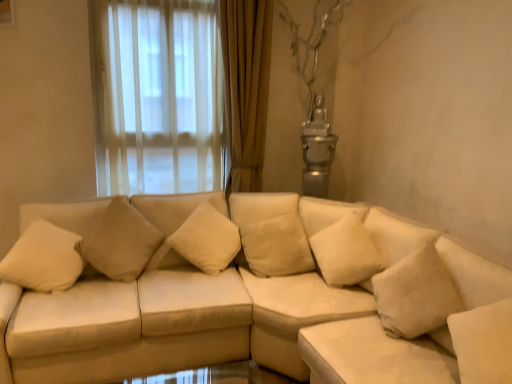
Question: Does beige leather couch at center have a lesser height compared to beige fabric pillow at center, arranged as the 1th pillow when viewed from the left?

Choices:
 (A) no
 (B) yes

Answer: (A)

Question: Considering the relative sizes of beige leather couch at center and beige fabric pillow at center, which is the second pillow from right to left, in the image provided, is beige leather couch at center taller than beige fabric pillow at center, which is the second pillow from right to left,?

Choices:
 (A) yes
 (B) no

Answer: (A)

Question: Does beige leather couch at center have a lesser width compared to beige fabric pillow at center, arranged as the 1th pillow when viewed from the left?

Choices:
 (A) yes
 (B) no

Answer: (B)

Question: Is beige leather couch at center closer to camera compared to beige fabric pillow at center, arranged as the 1th pillow when viewed from the left?

Choices:
 (A) no
 (B) yes

Answer: (B)

Question: Is beige leather couch at center not inside beige fabric pillow at center, which is the second pillow from right to left?

Choices:
 (A) no
 (B) yes

Answer: (B)

Question: Looking at their shapes, would you say beige leather couch at center is wider or thinner than beige fabric pillow at center, arranged as the 1th pillow when viewed from the left?

Choices:
 (A) thin
 (B) wide

Answer: (B)

Question: From their relative heights in the image, would you say beige leather couch at center is taller or shorter than beige fabric pillow at center, which is the second pillow from right to left?

Choices:
 (A) short
 (B) tall

Answer: (B)

Question: Based on their positions, is beige leather couch at center located to the left or right of beige fabric pillow at center, which is the second pillow from right to left?

Choices:
 (A) right
 (B) left

Answer: (A)

Question: Relative to beige fabric pillow at center, arranged as the 1th pillow when viewed from the left, is beige leather couch at center in front or behind?

Choices:
 (A) front
 (B) behind

Answer: (A)

Question: Based on their positions, is beige fabric pillow at center, positioned as the first pillow in right-to-left order, located to the left or right of beige fabric pillow at center, which is the second pillow from right to left?

Choices:
 (A) right
 (B) left

Answer: (A)

Question: In terms of size, does beige fabric pillow at center, which is the 2th pillow from left to right, appear bigger or smaller than beige fabric pillow at center, arranged as the 1th pillow when viewed from the left?

Choices:
 (A) big
 (B) small

Answer: (A)

Question: Which is correct: beige fabric pillow at center, which is the 2th pillow from left to right, is inside beige fabric pillow at center, arranged as the 1th pillow when viewed from the left, or outside of it?

Choices:
 (A) inside
 (B) outside

Answer: (B)

Question: Relative to beige fabric pillow at center, arranged as the 1th pillow when viewed from the left, is beige fabric pillow at center, which is the 2th pillow from left to right, in front or behind?

Choices:
 (A) front
 (B) behind

Answer: (B)

Question: Is beige leather couch at center inside the boundaries of beige fabric pillow at center, positioned as the first pillow in right-to-left order, or outside?

Choices:
 (A) outside
 (B) inside

Answer: (A)

Question: Is point (441, 274) closer or farther from the camera than point (293, 223)?

Choices:
 (A) closer
 (B) farther

Answer: (A)